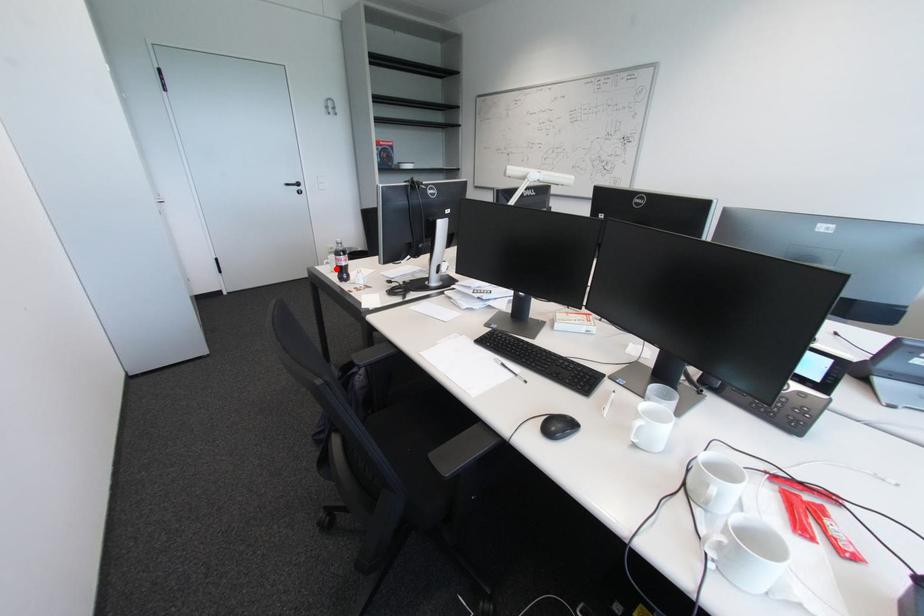
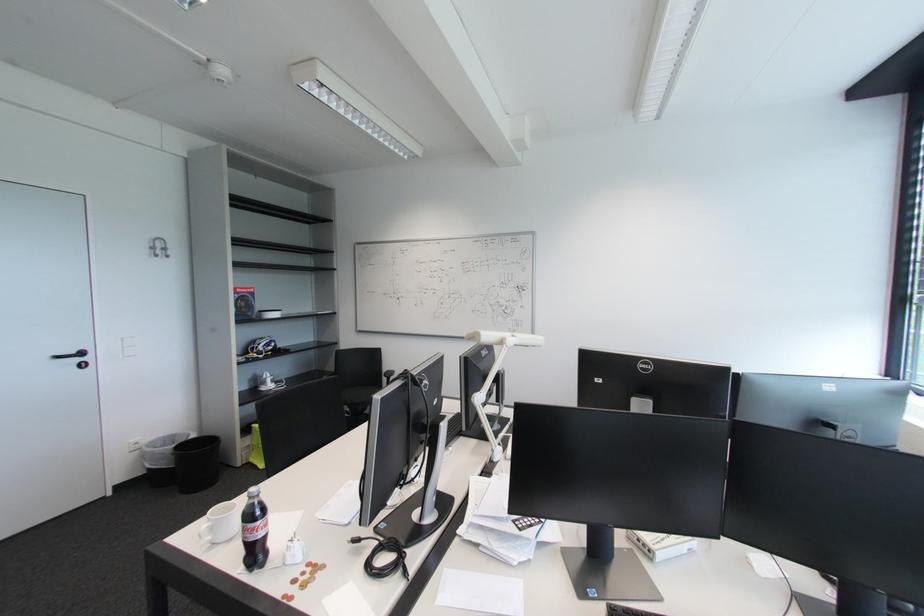
Find the pixel in the second image that matches the highlighted location in the first image.

(215, 539)